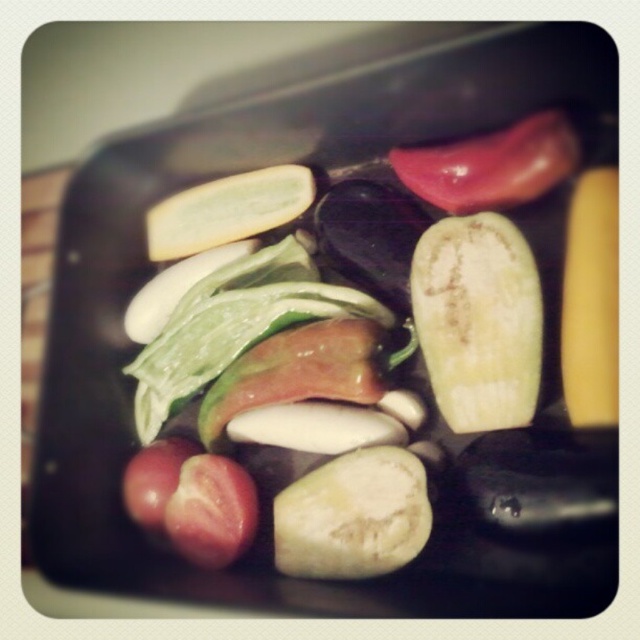
Question: Does shiny red tomato at upper center appear under red matte tomato at center?

Choices:
 (A) no
 (B) yes

Answer: (A)

Question: Which object is closer to the camera taking this photo?

Choices:
 (A) green matte apple at center
 (B) green matte eggplant at center
 (C) red matte tomato at center

Answer: (A)

Question: Among these objects, which one is farthest from the camera?

Choices:
 (A) green matte eggplant at center
 (B) shiny red tomato at upper center

Answer: (B)

Question: Is the position of red matte tomato at center less distant than that of red matte tomato at lower left?

Choices:
 (A) no
 (B) yes

Answer: (B)

Question: Estimate the real-world distances between objects in this image. Which object is farther from the red matte tomato at center?

Choices:
 (A) shiny red tomato at upper center
 (B) green matte eggplant at center
 (C) green matte apple at center
 (D) red matte tomato at lower left

Answer: (A)

Question: Can you confirm if green matte apple at center is positioned above shiny red tomato at upper center?

Choices:
 (A) no
 (B) yes

Answer: (A)